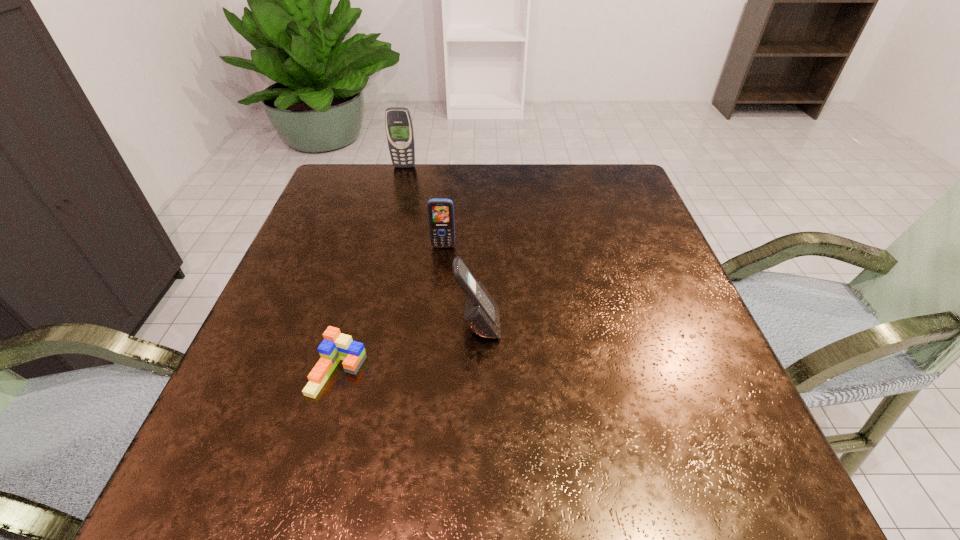
Identify the location of free space that is in between the leftmost cellular telephone and the nearest object. (371, 269).

The image size is (960, 540). I want to click on free area in between the rightmost object and the shortest object, so click(x=408, y=349).

The height and width of the screenshot is (540, 960). In order to click on free point between the rightmost object and the Lego in this screenshot , I will do `click(408, 349)`.

Find the location of a particular element. This screenshot has height=540, width=960. blank region between the farthest cellular telephone and the third nearest object is located at coordinates (423, 206).

The height and width of the screenshot is (540, 960). Identify the location of object that is the nearest to the nearest object. (481, 314).

Identify which object is located as the nearest to the second shortest object. Please provide its 2D coordinates. Your answer should be formatted as a tuple, i.e. [(x, y)], where the tuple contains the x and y coordinates of a point satisfying the conditions above.

[(481, 314)]

Point out which cellular telephone is positioned as the nearest to the second object from right to left. Please provide its 2D coordinates. Your answer should be formatted as a tuple, i.e. [(x, y)], where the tuple contains the x and y coordinates of a point satisfying the conditions above.

[(481, 314)]

You are a GUI agent. You are given a task and a screenshot of the screen. Output one action in this format:
    pyautogui.click(x=<x>, y=<y>)
    Task: Click on the closest cellular telephone to the second farthest cellular telephone
    The height and width of the screenshot is (540, 960).
    Given the screenshot: What is the action you would take?
    pyautogui.click(x=481, y=314)